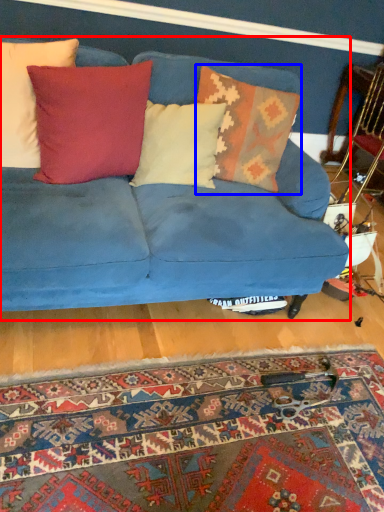
Question: Among these objects, which one is farthest to the camera, studio couch (highlighted by a red box) or pillow (highlighted by a blue box)?

Choices:
 (A) studio couch
 (B) pillow

Answer: (B)